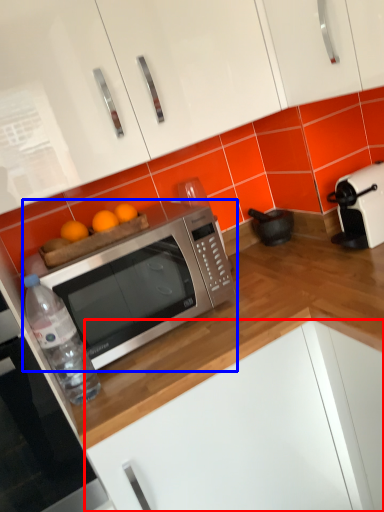
Question: Which object appears closest to the camera in this image, cabinetry (highlighted by a red box) or microwave oven (highlighted by a blue box)?

Choices:
 (A) cabinetry
 (B) microwave oven

Answer: (A)